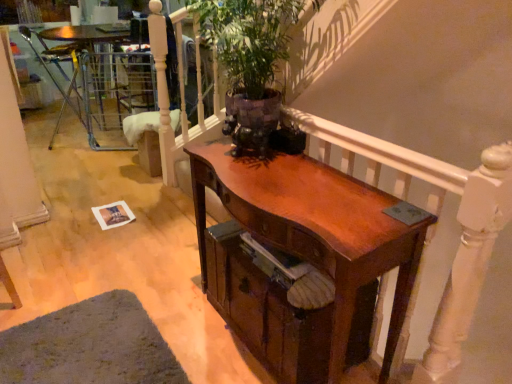
Question: Does shiny brown desk at center touch wooden drawer at center?

Choices:
 (A) no
 (B) yes

Answer: (A)

Question: Considering the relative sizes of shiny brown desk at center and wooden drawer at center in the image provided, is shiny brown desk at center wider than wooden drawer at center?

Choices:
 (A) yes
 (B) no

Answer: (B)

Question: Can you confirm if shiny brown desk at center is smaller than wooden drawer at center?

Choices:
 (A) yes
 (B) no

Answer: (B)

Question: Is shiny brown desk at center in front of wooden drawer at center?

Choices:
 (A) no
 (B) yes

Answer: (B)

Question: From a real-world perspective, is shiny brown desk at center below wooden drawer at center?

Choices:
 (A) yes
 (B) no

Answer: (B)

Question: From their relative heights in the image, would you say metallic silver chair at left is taller or shorter than wooden drawer at center?

Choices:
 (A) short
 (B) tall

Answer: (B)

Question: From a real-world perspective, is metallic silver chair at left above or below wooden drawer at center?

Choices:
 (A) below
 (B) above

Answer: (B)

Question: Is metallic silver chair at left in front of or behind wooden drawer at center in the image?

Choices:
 (A) behind
 (B) front

Answer: (A)

Question: Considering the positions of metallic silver chair at left and wooden drawer at center in the image, is metallic silver chair at left wider or thinner than wooden drawer at center?

Choices:
 (A) wide
 (B) thin

Answer: (B)

Question: Is shiny brown desk at center in front of or behind metallic silver chair at left in the image?

Choices:
 (A) front
 (B) behind

Answer: (A)

Question: Is shiny brown desk at center wider or thinner than metallic silver chair at left?

Choices:
 (A) wide
 (B) thin

Answer: (B)

Question: Is point (x=413, y=244) positioned closer to the camera than point (x=27, y=29)?

Choices:
 (A) farther
 (B) closer

Answer: (B)

Question: From a real-world perspective, is shiny brown desk at center above or below metallic silver chair at left?

Choices:
 (A) below
 (B) above

Answer: (A)

Question: Is wooden balustrade at upper center taller or shorter than metallic silver chair at left?

Choices:
 (A) short
 (B) tall

Answer: (B)

Question: From the image's perspective, is wooden balustrade at upper center positioned above or below metallic silver chair at left?

Choices:
 (A) above
 (B) below

Answer: (B)